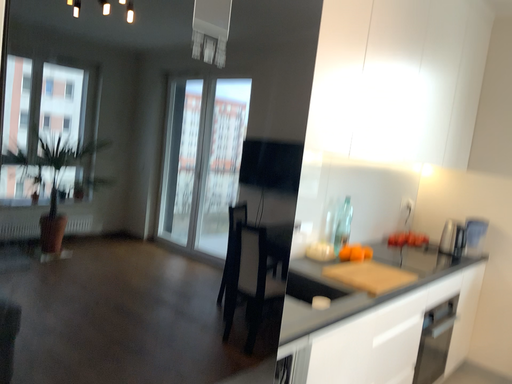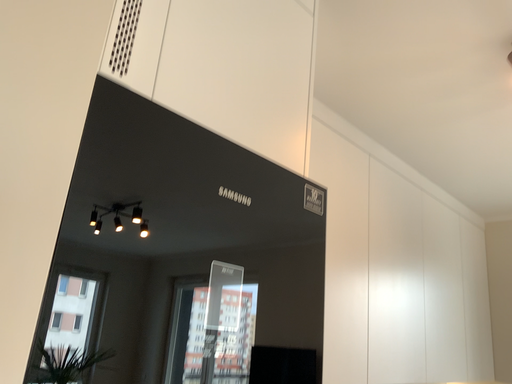
Question: How did the camera likely rotate when shooting the video?

Choices:
 (A) rotated upward
 (B) rotated downward

Answer: (A)